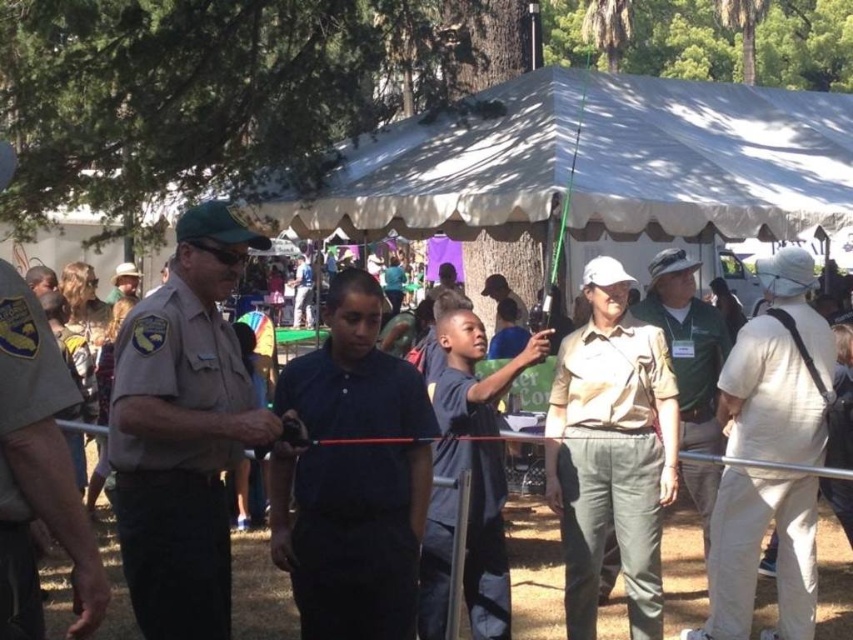
From the picture: You are a photographer at the event and want to capture both the brown uniform at left and the khaki uniform at center in a single shot. Which uniform should you position closer to the camera to ensure both are visible clearly?

To ensure both the brown uniform at left and the khaki uniform at center are visible clearly in a single shot, position the brown uniform at left closer to the camera since it is smaller than the khaki uniform at center.

You are organizing a group photo and need to arrange two people wearing the tan uniform at center and the matte khaki uniform at center side by side. Which uniform will require more space between them to accommodate their sizes?

The tan uniform at center requires more space because its width is larger than the matte khaki uniform at center.